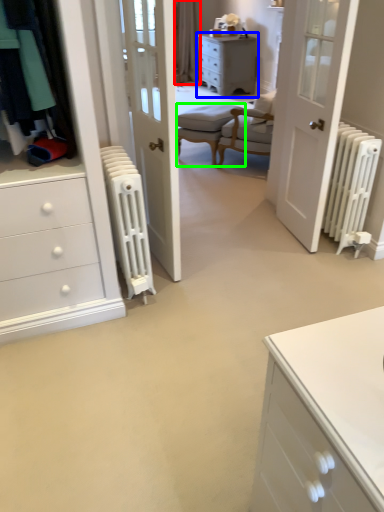
Question: Which object is the closest to the curtain (highlighted by a red box)? Choose among these: chest of drawers (highlighted by a blue box) or armchair (highlighted by a green box).

Choices:
 (A) chest of drawers
 (B) armchair

Answer: (A)